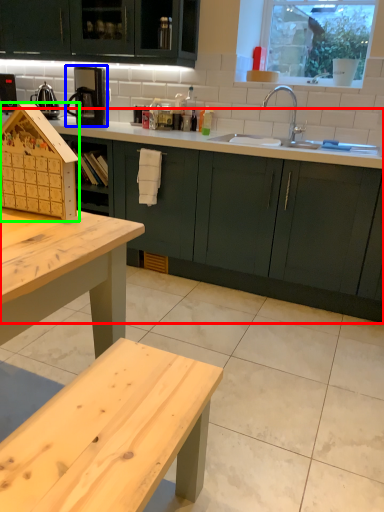
Question: Considering the real-world distances, which object is closest to countertop (highlighted by a red box)? coffee machine (highlighted by a blue box) or appliance (highlighted by a green box).

Choices:
 (A) coffee machine
 (B) appliance

Answer: (A)